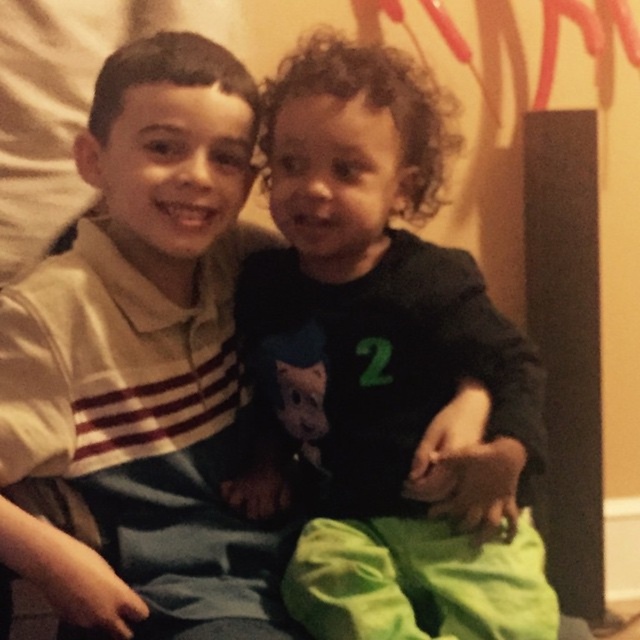
You are a photographer trying to capture a candid shot of the two children in the scene. You notice a point marked at coordinates [387,364] which corresponds to the dark green jersey at center. Where should you position your camera to ensure both children are in frame while focusing on the dark green jersey at center?

Position the camera so that the dark green jersey at center is at the focal point. Since the two children are sitting closely together and the jersey is centrally located, centering the shot on the jersey will naturally include both children in the frame.

The two children are sitting together in the scene. The older child is wearing a light polo shirt with red and white stripes, and the younger one has a dark green jersey at center. How far apart are they?

The two children are 31.58 inches apart.

You are a photographer trying to capture a clear photo of both the white striped shirt at left and the dark green jersey at center. Which one might be partially hidden in the photo due to their positions?

The white striped shirt at left is behind the dark green jersey at center, so it might be partially hidden in the photo.